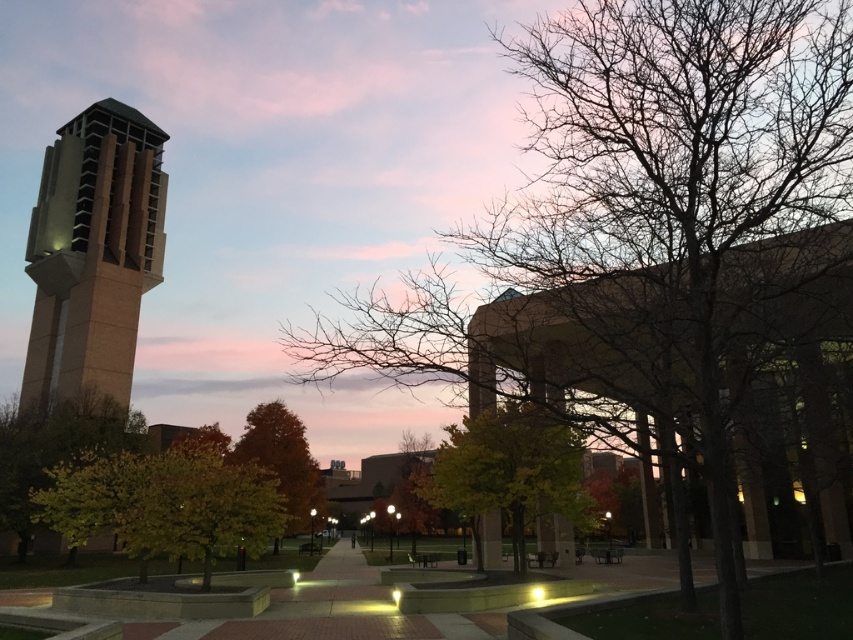
You are a photographer planning to capture the autumn scene in the image. You want to ensure that both the bare branches at center and the autumn leaves at center are clearly visible in your shot. Based on their sizes, which one might require you to adjust your camera focus more carefully to avoid blurriness?

The bare branches at center might be wider than autumn leaves at center, so you might need to adjust the camera focus more carefully for the autumn leaves at center to ensure they are not blurry.

You are a photographer aiming to capture the autumn leaves at center and the bare branches at center in a single frame. Based on their positions, which object should you adjust your camera to focus on first to ensure both are in the shot?

Since the bare branches at center are to the right of autumn leaves at center, you should focus on the autumn leaves at center first to ensure both are included in the frame.